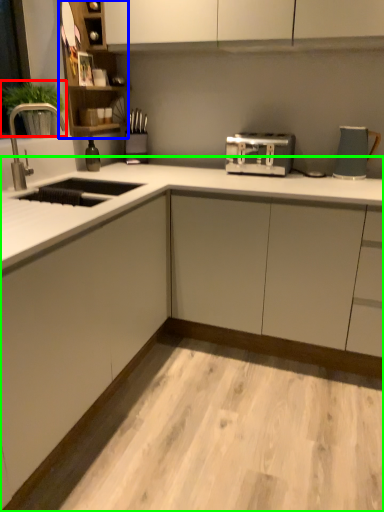
Question: Which object is positioned closest to plant (highlighted by a red box)? Select from cabinet (highlighted by a blue box) and countertop (highlighted by a green box).

Choices:
 (A) cabinet
 (B) countertop

Answer: (A)